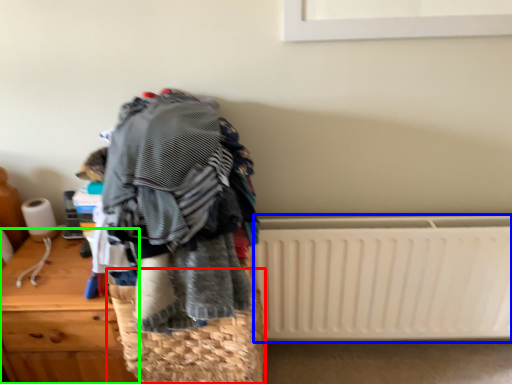
Question: Which is farther away from basket (highlighted by a red box)? radiator (highlighted by a blue box) or furniture (highlighted by a green box)?

Choices:
 (A) radiator
 (B) furniture

Answer: (A)